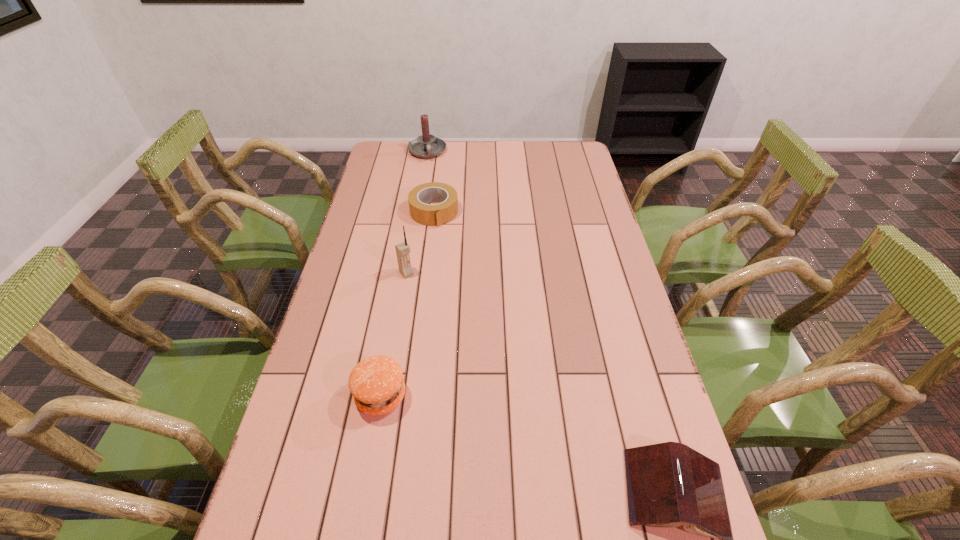
This screenshot has width=960, height=540. What are the coordinates of `patty` in the screenshot? It's located at click(376, 383).

This screenshot has width=960, height=540. I want to click on the third tallest object, so click(x=376, y=383).

I want to click on duct tape, so click(422, 212).

At what (x,y) coordinates should I click in order to perform the action: click on cellular telephone. Please return your answer as a coordinate pair (x, y). The height and width of the screenshot is (540, 960). Looking at the image, I should click on (403, 249).

What are the coordinates of `the farthest object` in the screenshot? It's located at (425, 146).

Where is `vacant region located on the back of the third tallest object`? vacant region located on the back of the third tallest object is located at coordinates (396, 306).

The width and height of the screenshot is (960, 540). Find the location of `blank space located 0.210m at the edge of the second farthest object`. blank space located 0.210m at the edge of the second farthest object is located at coordinates (452, 267).

Find the location of a particular element. Image resolution: width=960 pixels, height=540 pixels. vacant space positioned 0.120m at the edge of the second farthest object is located at coordinates (446, 249).

Locate an element on the screen. This screenshot has height=540, width=960. free space located 0.230m at the edge of the second farthest object is located at coordinates (454, 271).

In order to click on free space located 0.270m on the front of the cellular telephone, where the keypad is located in this screenshot , I will do `click(455, 336)`.